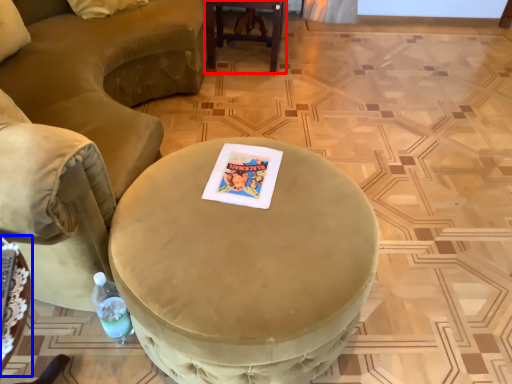
Question: Which object appears farthest to the camera in this image, table (highlighted by a red box) or table (highlighted by a blue box)?

Choices:
 (A) table
 (B) table

Answer: (A)